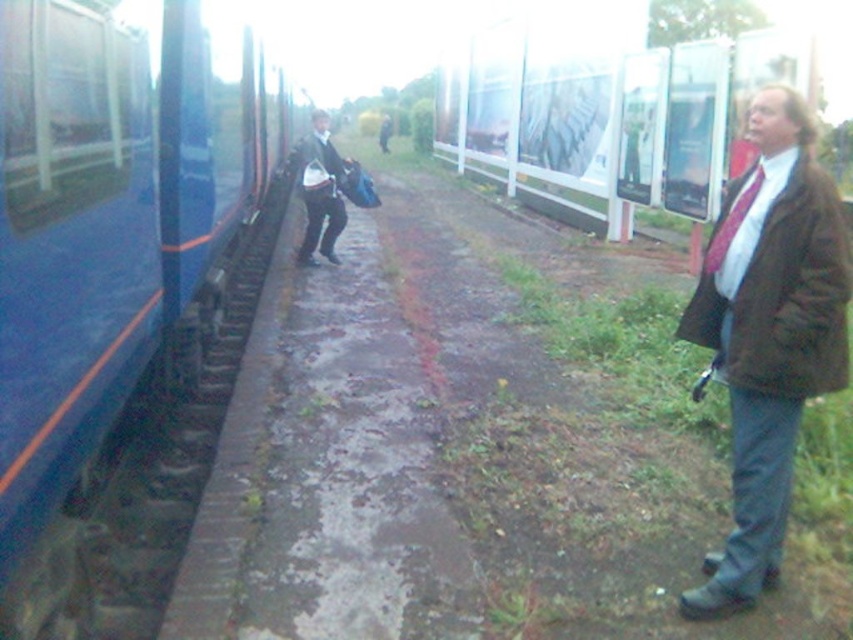
Between point (816, 316) and point (315, 243), which one is positioned in front?

Point (816, 316)

You are a GUI agent. You are given a task and a screenshot of the screen. Output one action in this format:
    pyautogui.click(x=<x>, y=<y>)
    Task: Click on the matte brown jacket at right
    Image resolution: width=853 pixels, height=640 pixels.
    Given the screenshot: What is the action you would take?
    pyautogui.click(x=769, y=333)

The image size is (853, 640). Identify the location of matte brown jacket at right. (769, 333).

Can you confirm if blue glossy train at left is positioned below matte brown jacket at right?

No, blue glossy train at left is not below matte brown jacket at right.

Who is positioned more to the right, blue glossy train at left or matte brown jacket at right?

Positioned to the right is matte brown jacket at right.

At what (x,y) coordinates should I click in order to perform the action: click on blue glossy train at left. Please return your answer as a coordinate pair (x, y). Looking at the image, I should click on (123, 289).

You are a GUI agent. You are given a task and a screenshot of the screen. Output one action in this format:
    pyautogui.click(x=<x>, y=<y>)
    Task: Click on the blue glossy train at left
    This screenshot has width=853, height=640.
    Given the screenshot: What is the action you would take?
    [123, 289]

Is blue glossy train at left above dark brown leather jacket at center?

No, blue glossy train at left is not above dark brown leather jacket at center.

Which is in front, point (44, 572) or point (345, 157)?

Point (44, 572)

This screenshot has width=853, height=640. In order to click on blue glossy train at left in this screenshot , I will do `click(123, 289)`.